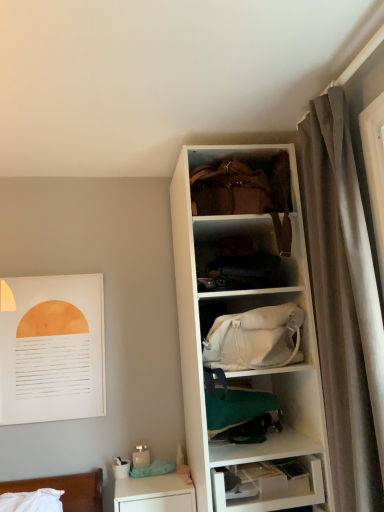
Question: Is white paper at upper left to the left of matte black clothing at center, acting as the first shelf starting from the top, from the viewer's perspective?

Choices:
 (A) no
 (B) yes

Answer: (B)

Question: Is the position of white paper at upper left less distant than that of matte black clothing at center, acting as the first shelf starting from the top?

Choices:
 (A) yes
 (B) no

Answer: (B)

Question: From a real-world perspective, is white paper at upper left below matte black clothing at center, acting as the first shelf starting from the top?

Choices:
 (A) no
 (B) yes

Answer: (B)

Question: Considering the relative positions of white paper at upper left and matte black clothing at center, acting as the first shelf starting from the top, in the image provided, is white paper at upper left to the right of matte black clothing at center, acting as the first shelf starting from the top, from the viewer's perspective?

Choices:
 (A) yes
 (B) no

Answer: (B)

Question: Does white paper at upper left have a greater height compared to matte black clothing at center, the fourth shelf ordered from the bottom?

Choices:
 (A) no
 (B) yes

Answer: (B)

Question: Does white paper at upper left contain matte black clothing at center, the fourth shelf ordered from the bottom?

Choices:
 (A) no
 (B) yes

Answer: (A)

Question: Does white fabric bag at center, acting as the second shelf starting from the top, have a greater height compared to white matte cabinet at center?

Choices:
 (A) yes
 (B) no

Answer: (B)

Question: Is white fabric bag at center, which is counted as the third shelf, starting from the bottom, closer to the viewer compared to white matte cabinet at center?

Choices:
 (A) no
 (B) yes

Answer: (B)

Question: From a real-world perspective, does white fabric bag at center, acting as the second shelf starting from the top, sit lower than white matte cabinet at center?

Choices:
 (A) no
 (B) yes

Answer: (B)

Question: Can you confirm if white fabric bag at center, which is counted as the third shelf, starting from the bottom, is bigger than white matte cabinet at center?

Choices:
 (A) yes
 (B) no

Answer: (B)

Question: Does white fabric bag at center, acting as the second shelf starting from the top, have a lesser width compared to white matte cabinet at center?

Choices:
 (A) no
 (B) yes

Answer: (A)

Question: Could you tell me if white fabric bag at center, acting as the second shelf starting from the top, is turned towards white matte cabinet at center?

Choices:
 (A) no
 (B) yes

Answer: (A)

Question: Is white glossy table at lower left wider than velvet gray curtain at right?

Choices:
 (A) no
 (B) yes

Answer: (B)